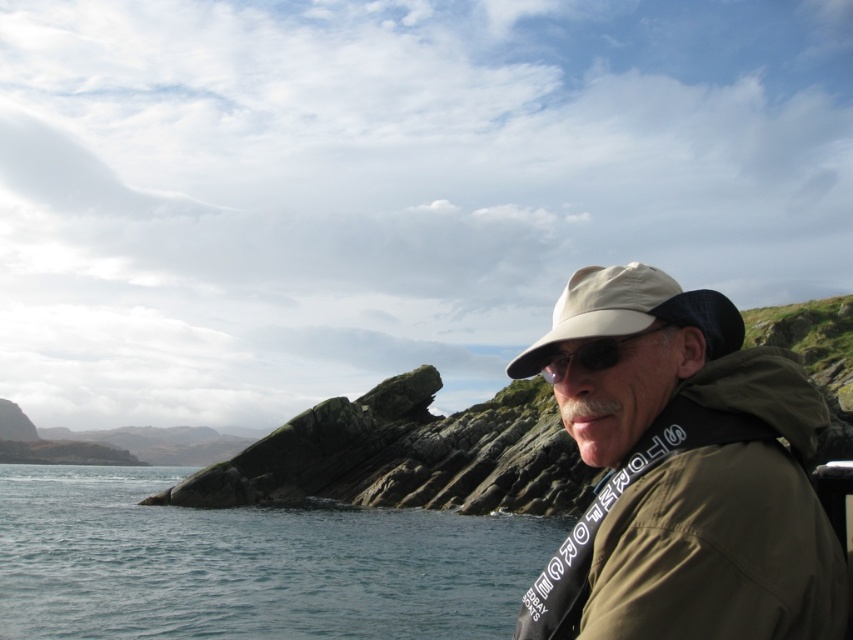
You are a photographer trying to capture the khaki fabric cap at upper right and the black reflective sunglasses at center in your shot. Which object should you focus on first if you want both to be in sharp focus?

You should focus on the khaki fabric cap at upper right first because it is closer to the viewer than the black reflective sunglasses at center. By focusing on the closer object, the farther one will also be in focus due to the depth of field.

You are a photographer aiming to capture the khaki fabric cap at upper right and the blue water at lower left in your shot. Which object is positioned higher in the frame?

The khaki fabric cap at upper right is positioned higher in the frame because it is shorter than the blue water at lower left, meaning it occupies a higher vertical position.